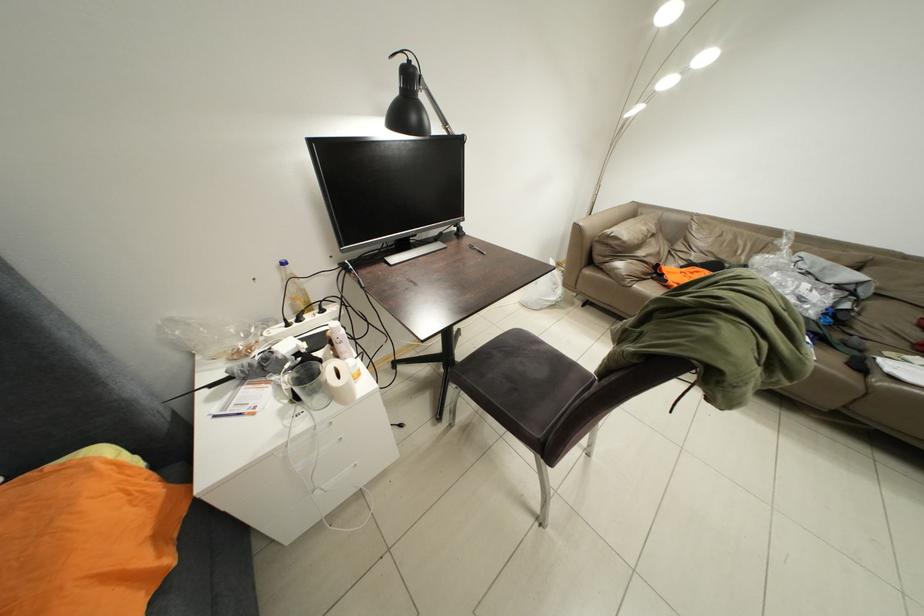
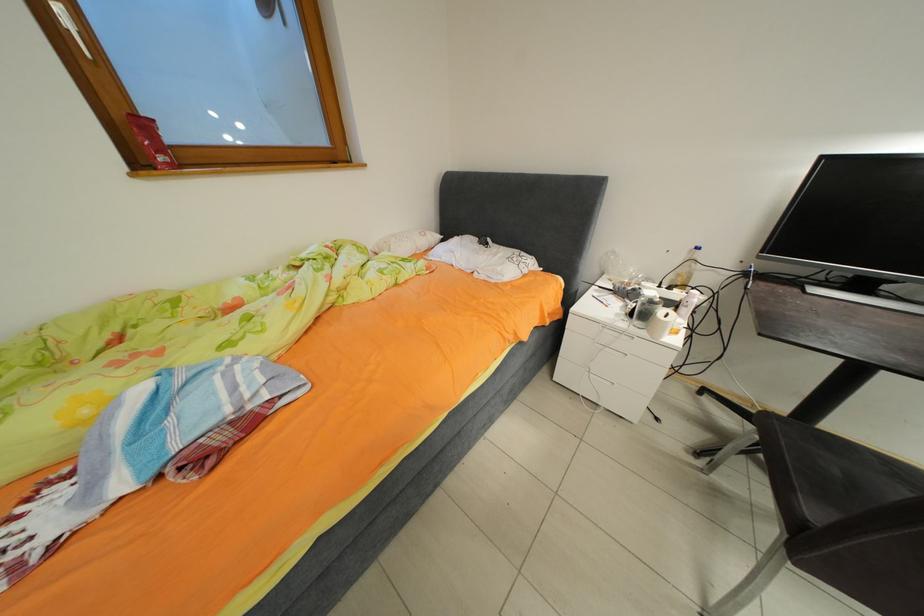
From the picture: How did the camera likely rotate?

The camera's rotation is toward left-down.